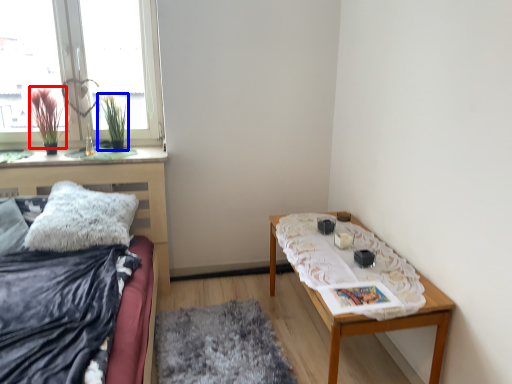
Question: Which object is further to the camera taking this photo, plant (highlighted by a red box) or plant (highlighted by a blue box)?

Choices:
 (A) plant
 (B) plant

Answer: (B)